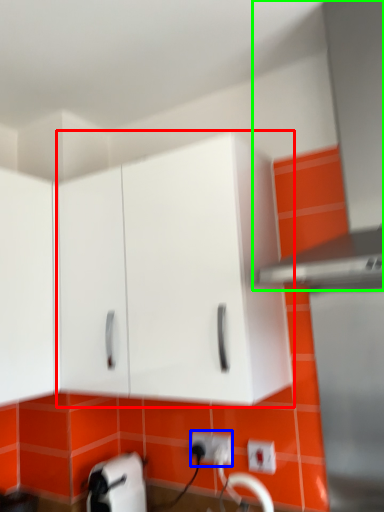
Question: Estimate the real-world distances between objects in this image. Which object is closer to cabinetry (highlighted by a red box), electric outlet (highlighted by a blue box) or exhaust hood (highlighted by a green box)?

Choices:
 (A) electric outlet
 (B) exhaust hood

Answer: (B)